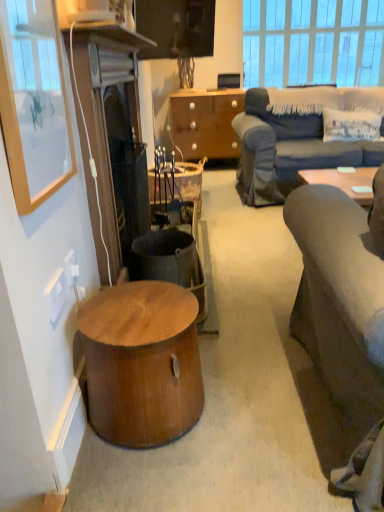
Question: Is white plastic power outlet at lower left, placed as the 2th power outlet when sorted from front to back, outside clear glass window at upper center?

Choices:
 (A) yes
 (B) no

Answer: (A)

Question: Is the position of white plastic power outlet at lower left, positioned as the 1th power outlet in back-to-front order, more distant than that of clear glass window at upper center?

Choices:
 (A) no
 (B) yes

Answer: (A)

Question: Can you confirm if white plastic power outlet at lower left, positioned as the 1th power outlet in back-to-front order, is smaller than clear glass window at upper center?

Choices:
 (A) no
 (B) yes

Answer: (B)

Question: Is white plastic power outlet at lower left, positioned as the 1th power outlet in back-to-front order, touching clear glass window at upper center?

Choices:
 (A) yes
 (B) no

Answer: (B)

Question: Does white plastic power outlet at lower left, placed as the 2th power outlet when sorted from front to back, appear on the right side of clear glass window at upper center?

Choices:
 (A) no
 (B) yes

Answer: (A)

Question: Does white plastic power outlet at lower left, placed as the 2th power outlet when sorted from front to back, have a lesser height compared to clear glass window at upper center?

Choices:
 (A) yes
 (B) no

Answer: (A)

Question: Is rustic wood trash bin/can at center located outside clear glass window at upper center?

Choices:
 (A) no
 (B) yes

Answer: (B)

Question: Is rustic wood trash bin/can at center turned away from clear glass window at upper center?

Choices:
 (A) yes
 (B) no

Answer: (B)

Question: Can you confirm if rustic wood trash bin/can at center is smaller than clear glass window at upper center?

Choices:
 (A) yes
 (B) no

Answer: (A)

Question: Can you confirm if rustic wood trash bin/can at center is thinner than clear glass window at upper center?

Choices:
 (A) yes
 (B) no

Answer: (B)

Question: Considering the relative sizes of rustic wood trash bin/can at center and clear glass window at upper center in the image provided, is rustic wood trash bin/can at center bigger than clear glass window at upper center?

Choices:
 (A) yes
 (B) no

Answer: (B)

Question: Considering the relative sizes of rustic wood trash bin/can at center and clear glass window at upper center in the image provided, is rustic wood trash bin/can at center taller than clear glass window at upper center?

Choices:
 (A) yes
 (B) no

Answer: (B)

Question: Is dark brown wood fireplace at left turned away from clear glass window at upper center?

Choices:
 (A) no
 (B) yes

Answer: (A)